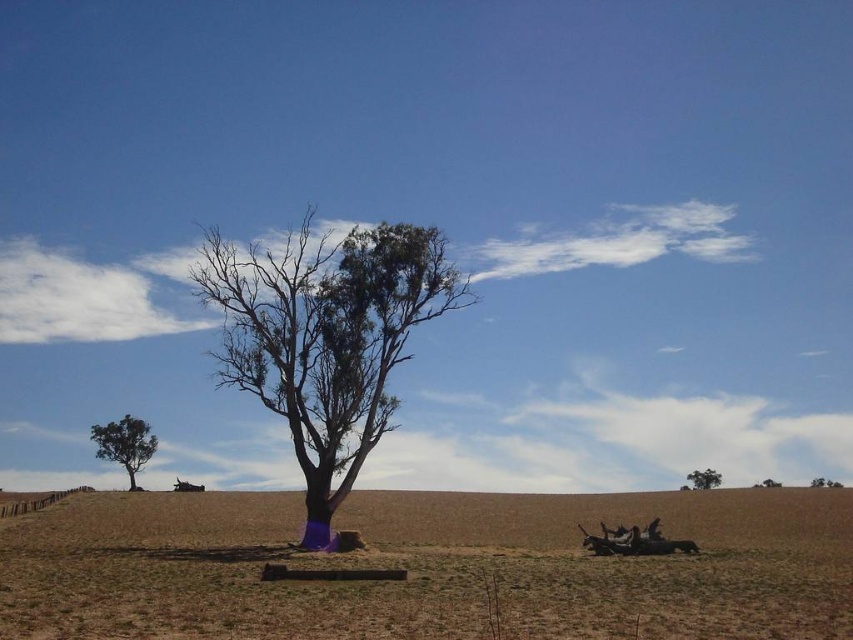
Is green leafy tree at center to the left of brown rough tree at lower right from the viewer's perspective?

Yes, green leafy tree at center is to the left of brown rough tree at lower right.

Between green leafy tree at center and brown rough tree at lower right, which one appears on the left side from the viewer's perspective?

green leafy tree at center

Identify the location of green leafy tree at center. (325, 337).

Does green leafy tree at center appear on the right side of green leafy tree at lower left?

Yes, green leafy tree at center is to the right of green leafy tree at lower left.

The height and width of the screenshot is (640, 853). What do you see at coordinates (325, 337) in the screenshot?
I see `green leafy tree at center` at bounding box center [325, 337].

Identify the location of green leafy tree at center. The height and width of the screenshot is (640, 853). (325, 337).

Does point (396, 232) come closer to viewer compared to point (712, 486)?

Yes, it is in front of point (712, 486).

In the scene shown: Is green leafy tree at center further to the viewer compared to green leafy tree at upper right?

No, green leafy tree at center is in front of green leafy tree at upper right.

Which is in front, point (357, 234) or point (688, 477)?

Point (357, 234) is in front.

Where is `green leafy tree at center`? This screenshot has height=640, width=853. green leafy tree at center is located at coordinates (325, 337).